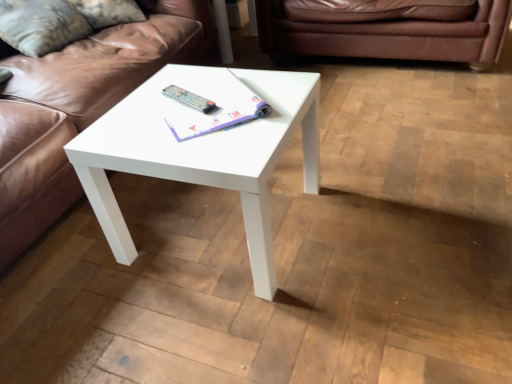
This screenshot has height=384, width=512. Identify the location of empty space that is to the right of white glossy coffee table at center. (371, 215).